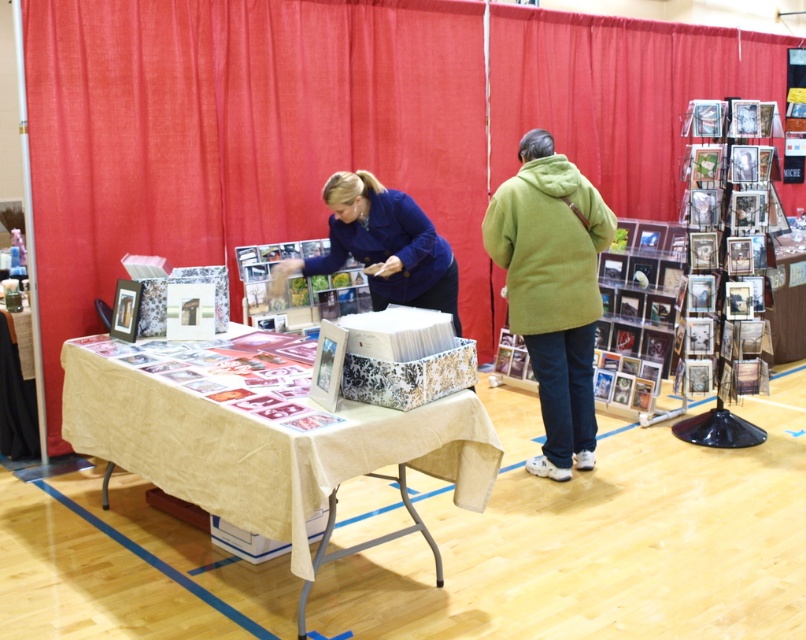
Question: Which object is farther from the camera taking this photo?

Choices:
 (A) blue fabric at center
 (B) beige fabric-covered table at center

Answer: (A)

Question: Is beige fabric-covered table at center positioned before blue fabric at center?

Choices:
 (A) yes
 (B) no

Answer: (A)

Question: Which of the following is the closest to the observer?

Choices:
 (A) green fuzzy jacket at center
 (B) beige fabric-covered table at center

Answer: (B)

Question: Is beige fabric-covered table at center positioned at the back of green fuzzy jacket at center?

Choices:
 (A) yes
 (B) no

Answer: (B)

Question: Can you confirm if beige fabric-covered table at center is smaller than green fuzzy jacket at center?

Choices:
 (A) yes
 (B) no

Answer: (B)

Question: Which object is closer to the camera taking this photo?

Choices:
 (A) green fuzzy jacket at center
 (B) beige fabric-covered table at center

Answer: (B)